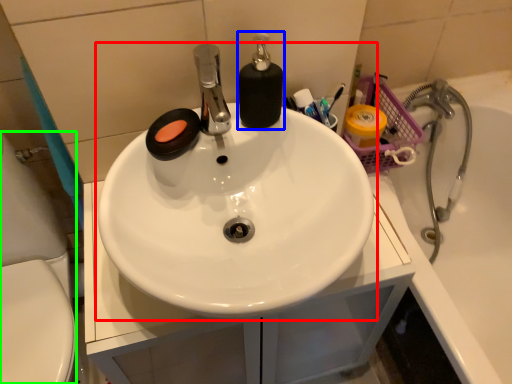
Question: Based on their relative distances, which object is farther from sink (highlighted by a red box)? Choose from soap dispenser (highlighted by a blue box) and porcelain (highlighted by a green box).

Choices:
 (A) soap dispenser
 (B) porcelain

Answer: (B)